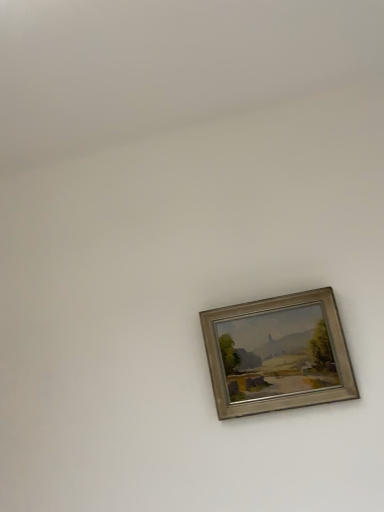
Identify the location of gold-toned wooden frame at lower right. This screenshot has width=384, height=512. (278, 354).

Describe the element at coordinates (278, 354) in the screenshot. The image size is (384, 512). I see `gold-toned wooden frame at lower right` at that location.

In order to face gold-toned wooden frame at lower right, should I rotate leftwards or rightwards?

A 11.140 degree turn to the right will do.

What is the approximate height of gold-toned wooden frame at lower right?

It is 11.68 inches.

Where is `gold-toned wooden frame at lower right`? gold-toned wooden frame at lower right is located at coordinates (278, 354).